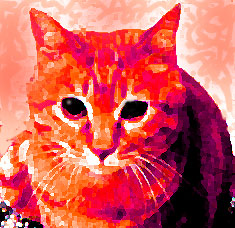
Image resolution: width=235 pixels, height=228 pixels. Find the location of `chest`. chest is located at coordinates pyautogui.click(x=108, y=204).